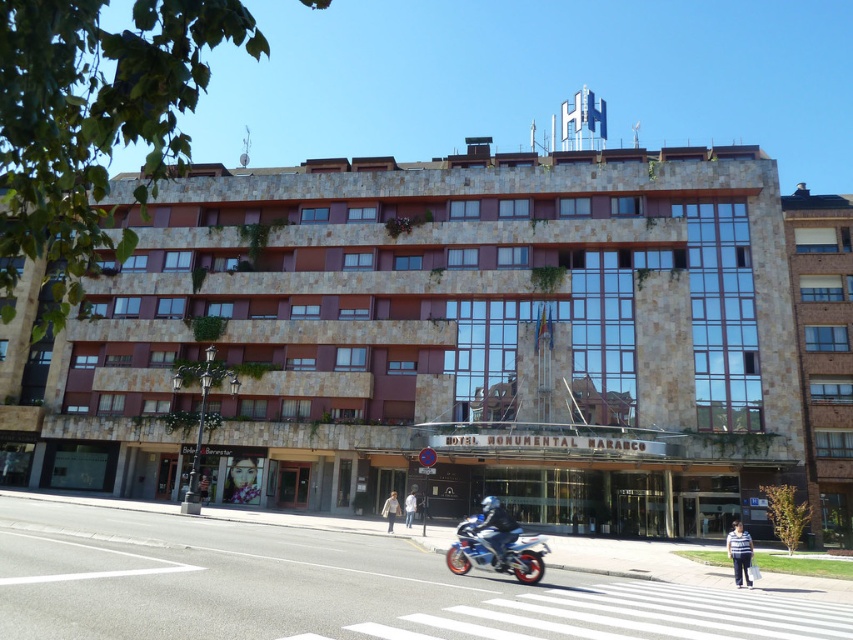
Can you confirm if shiny blue motorcycle at center is smaller than light beige jacket at center?

Incorrect, shiny blue motorcycle at center is not smaller in size than light beige jacket at center.

Which is below, shiny blue motorcycle at center or light beige jacket at center?

light beige jacket at center

What do you see at coordinates (496, 529) in the screenshot? I see `shiny blue motorcycle at center` at bounding box center [496, 529].

The image size is (853, 640). Identify the location of shiny blue motorcycle at center. (496, 529).

Between point (825, 460) and point (746, 541), which one is positioned in front?

Point (746, 541)

Between point (792, 248) and point (746, 561), which one is positioned behind?

The point (792, 248) is behind.

Find the location of `brown stone building at right`. brown stone building at right is located at coordinates (822, 352).

Is point (520, 561) less distant than point (386, 499)?

Yes.

Which is more to the right, metallic blue motorcycle at center or light beige jacket at center?

metallic blue motorcycle at center is more to the right.

Find the location of `metallic blue motorcycle at center`. metallic blue motorcycle at center is located at coordinates (496, 545).

Where is `metallic blue motorcycle at center`? metallic blue motorcycle at center is located at coordinates (496, 545).